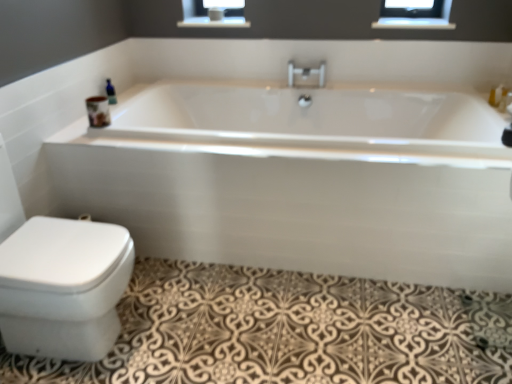
In order to click on free space in front of polished chrome faucet at center in this screenshot , I will do `click(309, 97)`.